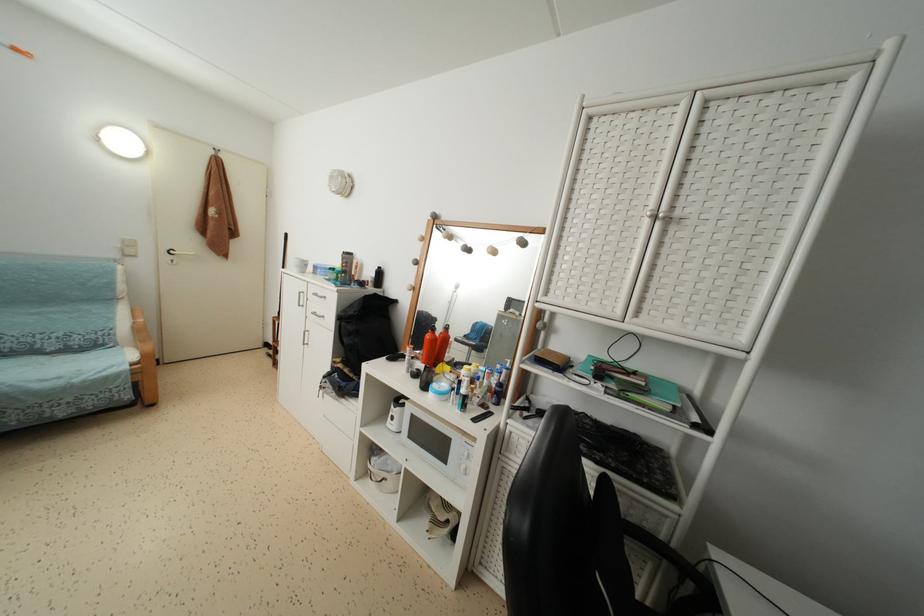
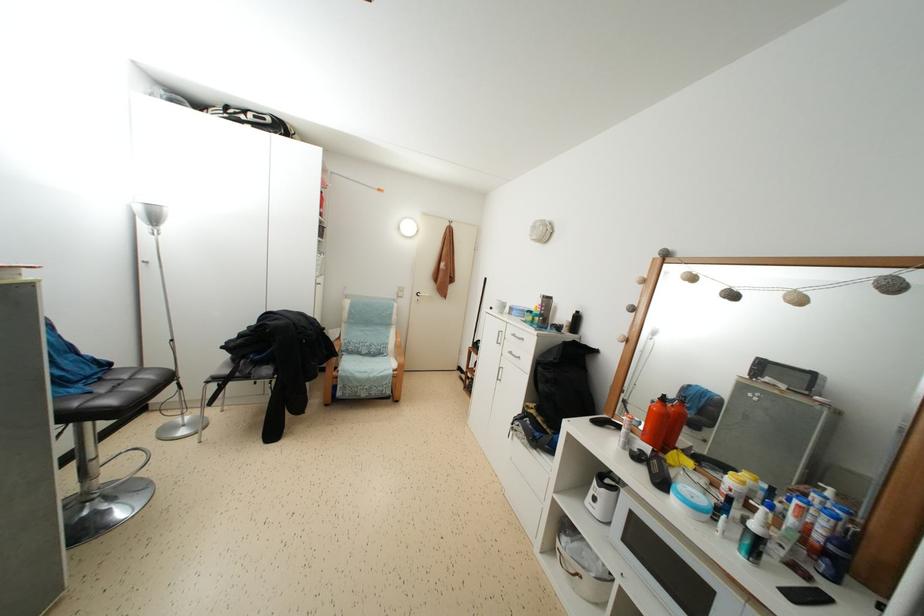
The point at [138,361] is marked in the first image. Where is the corresponding point in the second image?

(398, 370)